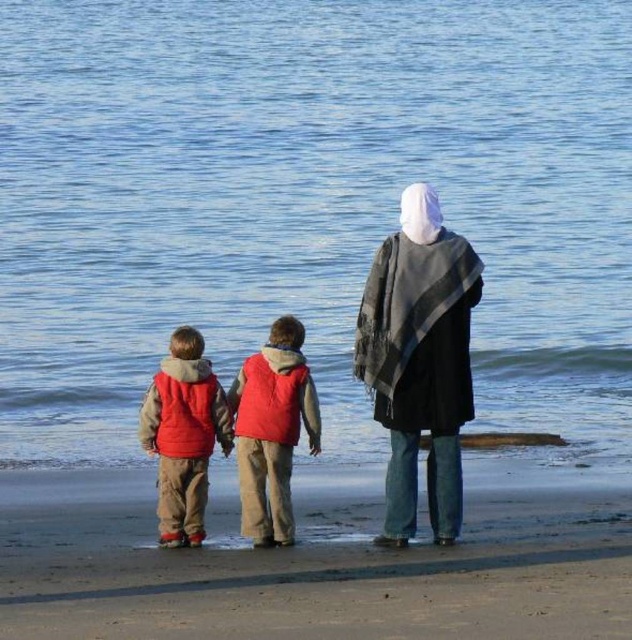
Is red fleece vest at center further to camera compared to matte red vest at left?

No, it is not.

Is point (300, 321) positioned behind point (147, 422)?

No, (300, 321) is in front of (147, 422).

Where is `red fleece vest at center`? red fleece vest at center is located at coordinates (270, 429).

Is brown sand at lower center shorter than red fleece vest at center?

Yes.

Is brown sand at lower center wider than red fleece vest at center?

Yes, brown sand at lower center is wider than red fleece vest at center.

Which is in front, point (6, 493) or point (288, 445)?

Point (288, 445) is more forward.

The width and height of the screenshot is (632, 640). Find the location of `brown sand at lower center`. brown sand at lower center is located at coordinates (313, 563).

Measure the distance from red fleece vests at center to matte red vest at left.

Answer: red fleece vests at center and matte red vest at left are 1.45 meters apart.

Is the position of red fleece vests at center less distant than that of matte red vest at left?

Yes, red fleece vests at center is closer to the viewer.

Is point (380, 244) farther from camera compared to point (198, 340)?

That is False.

Identify the location of red fleece vests at center. (420, 360).